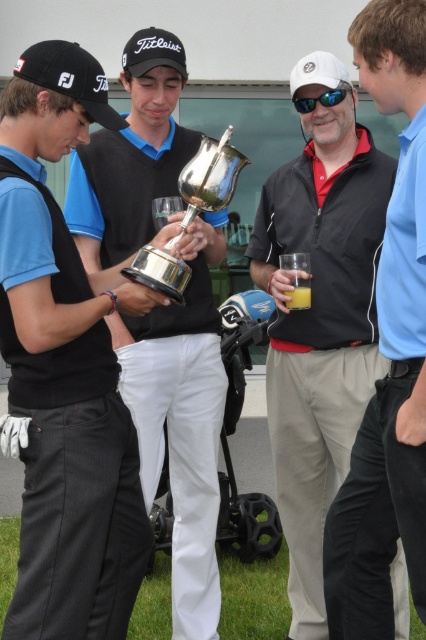
You are standing in front of the group at the golf course. There are two points marked in the image. The first point is at coordinates point (187, 216) and the second is at point (88, 93). Which point is closer to you?

Point (88, 93) is closer to you because it is less further than point (187, 216).

From the picture: Please provide the 2D coordinates of the shiny silver trophy at center in the image. Use the format of a point with two decimal places, such as 0.5,0.5.

The 2D coordinates of the shiny silver trophy at center are at point [181,426].

You are a photographer at the event and need to capture a photo where both the black matte jacket at center and the silver polished trophy at center are visible. Based on their positions, which object should be placed closer to the left side of the photo frame?

The silver polished trophy at center should be placed closer to the left side of the photo frame because the black matte jacket at center is positioned on the right side of it.